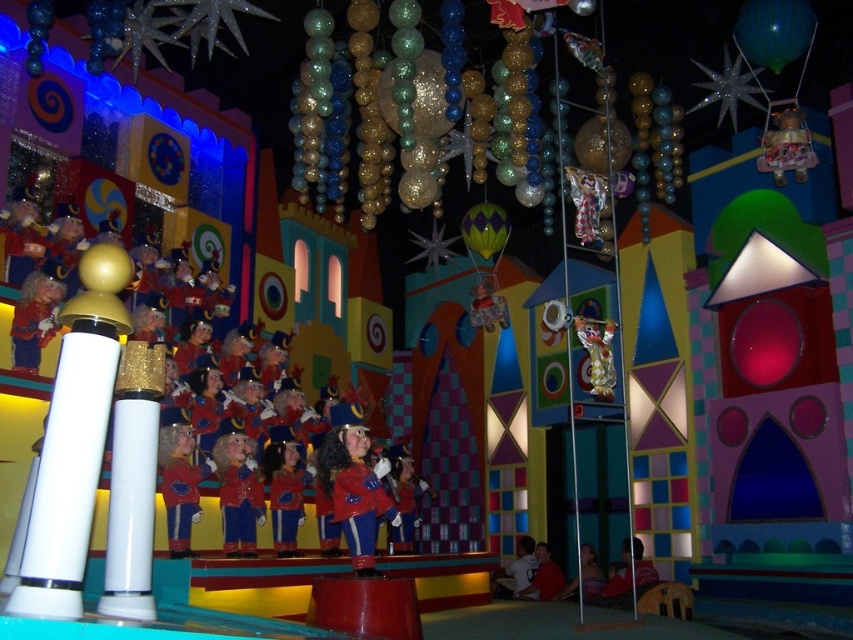
You are a visitor at this venue and want to take a photo of both the green shiny balloon at upper right and the shiny blue uniform at center. Which object should you position to the left to ensure both are in the frame?

The shiny blue uniform at center should be positioned to the left because the green shiny balloon at upper right is already on its right side, so moving the uniform to the left would align both within the frame.

You are a child trying to grab the green shiny balloon at upper right and the shiny blue uniform at center. Which object is smaller in size?

The green shiny balloon at upper right is smaller in size than the shiny blue uniform at center, so it occupies less space.

You are a child looking up at the decorations in the room. You see the green shiny balloon at upper right and the shiny metallic doll at upper right. Which one is higher?

The green shiny balloon at upper right is positioned over the shiny metallic doll at upper right, so it is higher.